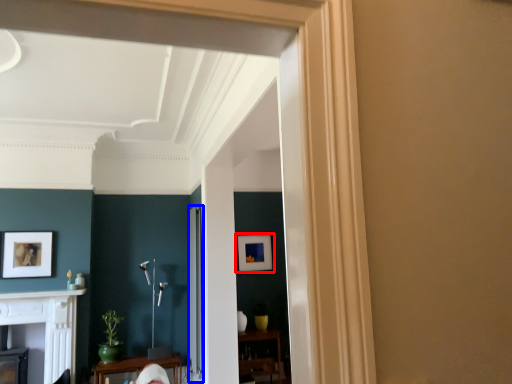
Question: Which point is further to the camera, picture frame (highlighted by a red box) or glass door (highlighted by a blue box)?

Choices:
 (A) picture frame
 (B) glass door

Answer: (A)